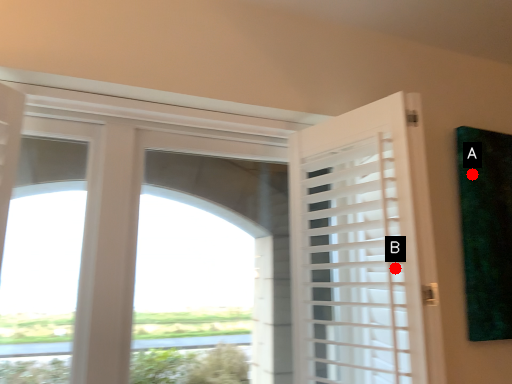
Question: Two points are circled on the image, labeled by A and B beside each circle. Which of the following is the farthest from the observer?

Choices:
 (A) A is further
 (B) B is further

Answer: (A)